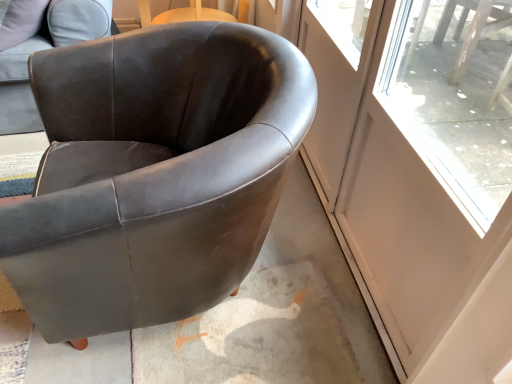
Question: Considering the relative sizes of transparent glass screen door at right, the first screen door in the right-to-left sequence, and matte black armchair at center, positioned as the second chair in left-to-right order, in the image provided, is transparent glass screen door at right, the first screen door in the right-to-left sequence, wider than matte black armchair at center, positioned as the second chair in left-to-right order,?

Choices:
 (A) no
 (B) yes

Answer: (A)

Question: Is transparent glass screen door at right, which appears as the 2th screen door when viewed from the left, to the right of matte black armchair at center, the first chair in the right-to-left sequence, from the viewer's perspective?

Choices:
 (A) yes
 (B) no

Answer: (A)

Question: Is transparent glass screen door at right, the first screen door in the right-to-left sequence, taller than matte black armchair at center, the first chair in the right-to-left sequence?

Choices:
 (A) yes
 (B) no

Answer: (A)

Question: Would you say transparent glass screen door at right, which appears as the 2th screen door when viewed from the left, is outside matte black armchair at center, positioned as the second chair in left-to-right order?

Choices:
 (A) no
 (B) yes

Answer: (B)

Question: Is transparent glass screen door at right, which appears as the 2th screen door when viewed from the left, far from matte black armchair at center, the first chair in the right-to-left sequence?

Choices:
 (A) yes
 (B) no

Answer: (A)

Question: Is clear glass screen door at upper right, marked as the 1th screen door in a left-to-right arrangement, inside or outside of transparent glass screen door at right, which appears as the 2th screen door when viewed from the left?

Choices:
 (A) inside
 (B) outside

Answer: (B)

Question: Is point (323, 192) positioned closer to the camera than point (437, 249)?

Choices:
 (A) closer
 (B) farther

Answer: (B)

Question: Considering their positions, is clear glass screen door at upper right, the 2th screen door in the right-to-left sequence, located in front of or behind transparent glass screen door at right, which appears as the 2th screen door when viewed from the left?

Choices:
 (A) front
 (B) behind

Answer: (B)

Question: Based on their sizes in the image, would you say clear glass screen door at upper right, marked as the 1th screen door in a left-to-right arrangement, is bigger or smaller than transparent glass screen door at right, the first screen door in the right-to-left sequence?

Choices:
 (A) small
 (B) big

Answer: (A)

Question: From the image's perspective, is transparent glass screen door at right, which appears as the 2th screen door when viewed from the left, above or below matte black armchair at center, the first chair in the right-to-left sequence?

Choices:
 (A) below
 (B) above

Answer: (A)

Question: Is transparent glass screen door at right, which appears as the 2th screen door when viewed from the left, inside or outside of matte black armchair at center, the first chair in the right-to-left sequence?

Choices:
 (A) inside
 (B) outside

Answer: (B)

Question: Is transparent glass screen door at right, which appears as the 2th screen door when viewed from the left, taller or shorter than matte black armchair at center, the first chair in the right-to-left sequence?

Choices:
 (A) tall
 (B) short

Answer: (A)

Question: From a real-world perspective, is transparent glass screen door at right, which appears as the 2th screen door when viewed from the left, physically located above or below matte black armchair at center, the first chair in the right-to-left sequence?

Choices:
 (A) above
 (B) below

Answer: (A)

Question: In the image, is matte black armchair at center, positioned as the second chair in left-to-right order, positioned in front of or behind transparent glass screen door at right, the first screen door in the right-to-left sequence?

Choices:
 (A) behind
 (B) front

Answer: (A)

Question: In terms of size, does matte black armchair at center, positioned as the second chair in left-to-right order, appear bigger or smaller than transparent glass screen door at right, which appears as the 2th screen door when viewed from the left?

Choices:
 (A) big
 (B) small

Answer: (A)